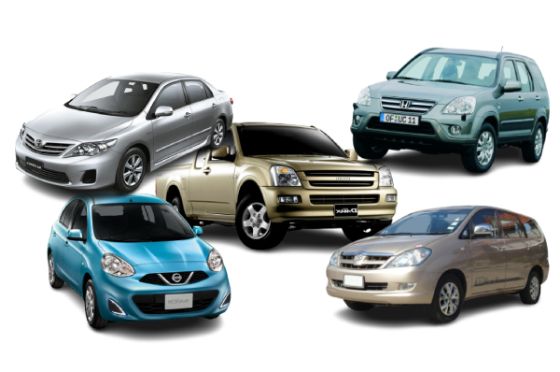
This screenshot has width=560, height=372. I want to click on hood, so click(385, 248), click(424, 97), click(330, 167), click(64, 132), click(156, 261).